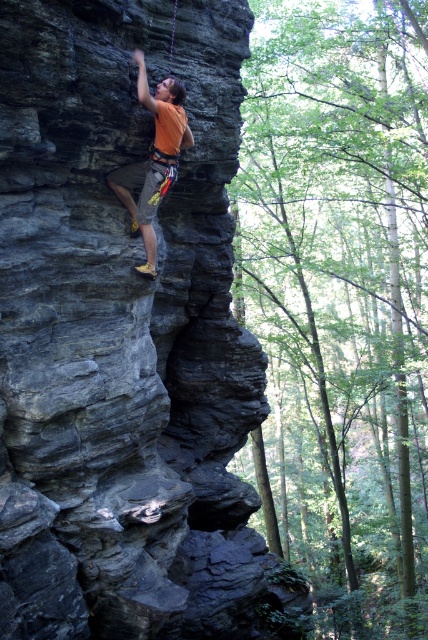
Question: Among these points, which one is farthest from the camera?

Choices:
 (A) (65, 202)
 (B) (145, 177)

Answer: (B)

Question: Does dark gray stone cliff at center have a greater width compared to orange fabric climbing harness at upper center?

Choices:
 (A) no
 (B) yes

Answer: (B)

Question: Can you confirm if dark gray stone cliff at center is positioned above orange fabric climbing harness at upper center?

Choices:
 (A) no
 (B) yes

Answer: (A)

Question: Does dark gray stone cliff at center have a greater width compared to orange fabric climbing harness at upper center?

Choices:
 (A) no
 (B) yes

Answer: (B)

Question: Among these points, which one is farthest from the camera?

Choices:
 (A) [x=163, y=145]
 (B) [x=35, y=221]

Answer: (A)